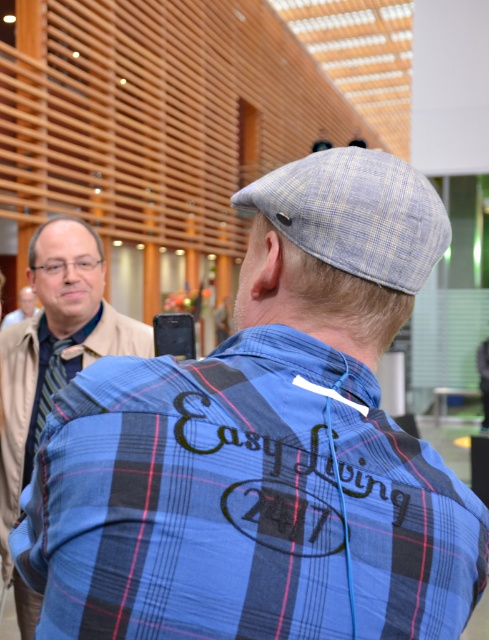
You are a photographer standing at the camera position. You want to adjust the focus to capture the striped fabric tie at left clearly. Is the tie within the camera lens range of 3 meters?

The striped fabric tie at left and camera are 3.10 meters apart from each other, so the tie is slightly out of the camera lens range of 3 meters.

Based on the photo, you are at an event and see a man wearing a matte black shirt at upper left and a striped fabric tie at left. Which item is located to the right of the other?

The matte black shirt at upper left is positioned on the right side of striped fabric tie at left.